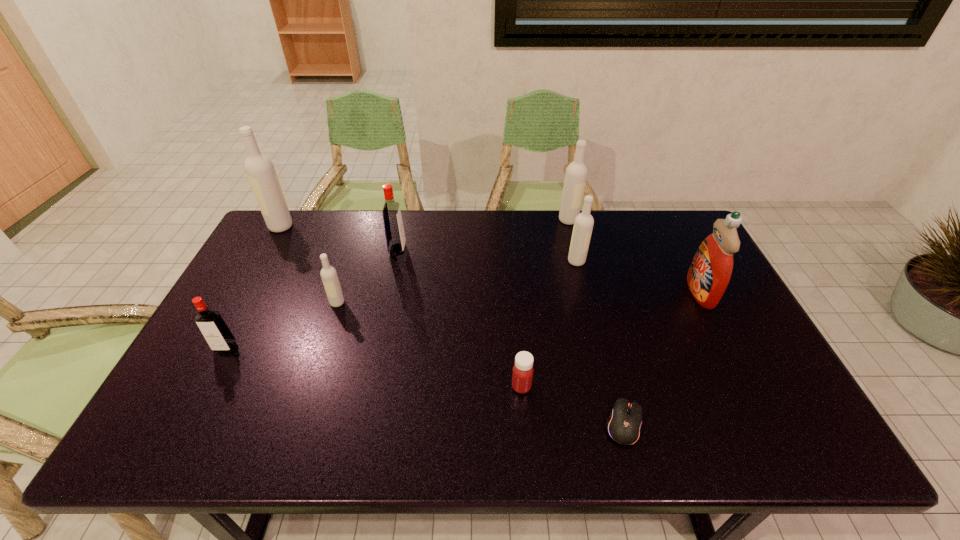
Where is `vacant space at the far edge`? vacant space at the far edge is located at coordinates (528, 222).

This screenshot has width=960, height=540. I want to click on blank area at the near edge, so click(385, 418).

I want to click on vacant space at the left edge of the desktop, so [244, 312].

Identify the location of free region at the right edge of the desktop. The height and width of the screenshot is (540, 960). (729, 368).

You are a GUI agent. You are given a task and a screenshot of the screen. Output one action in this format:
    pyautogui.click(x=<x>, y=<y>)
    Task: Click on the vacant space at the far left corner of the desktop
    This screenshot has width=960, height=540.
    Given the screenshot: What is the action you would take?
    point(305,225)

At what (x,y) coordinates should I click in order to perform the action: click on free point at the near left corner. Please return your answer as a coordinate pair (x, y). Looking at the image, I should click on (207, 417).

Locate an element on the screen. free region at the far right corner of the desktop is located at coordinates (661, 225).

Locate an element on the screen. Image resolution: width=960 pixels, height=540 pixels. vacant point located between the third smallest white vodka and the red medicine is located at coordinates (545, 303).

Identify the location of vacant space in between the detergent and the second tallest vodka. This screenshot has height=540, width=960. (635, 256).

This screenshot has width=960, height=540. What are the coordinates of `blank region between the nearest vodka and the biggest white vodka` in the screenshot? It's located at (253, 287).